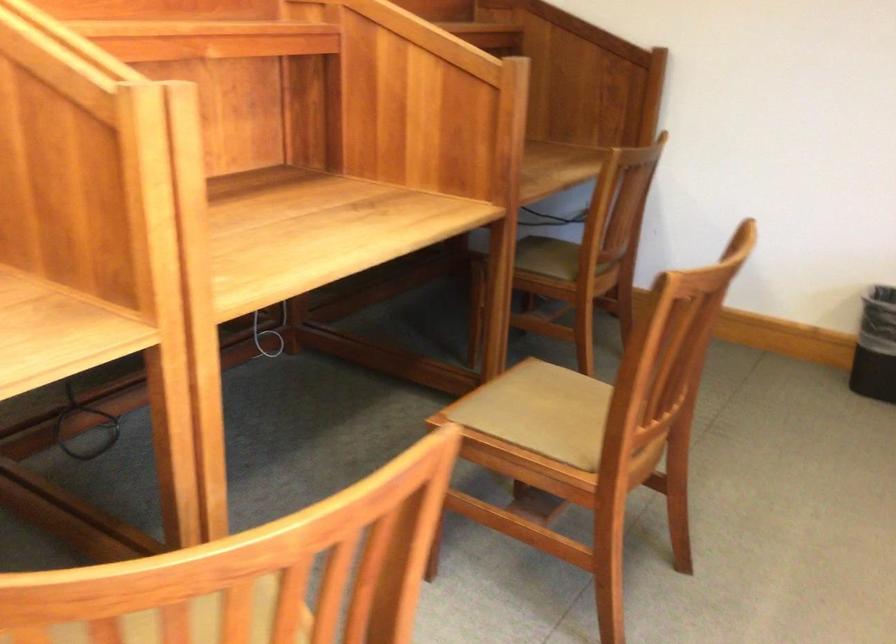
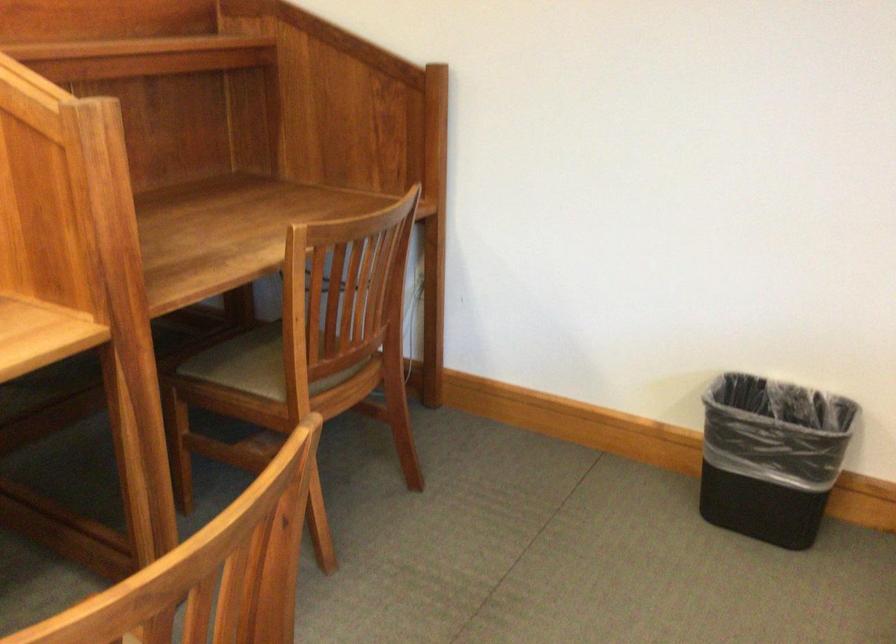
Locate, in the second image, the point that corresponds to point (545, 245) in the first image.

(254, 351)